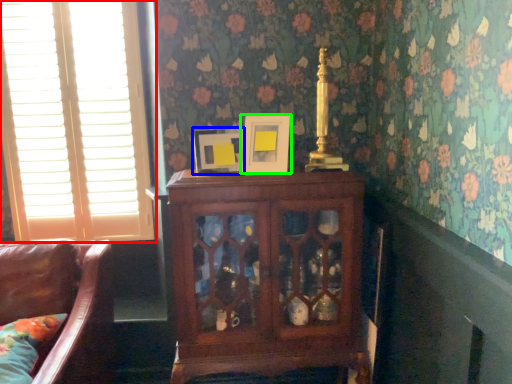
Question: Which object is the farthest from window (highlighted by a red box)? Choose among these: picture frame (highlighted by a blue box) or picture frame (highlighted by a green box).

Choices:
 (A) picture frame
 (B) picture frame

Answer: (B)